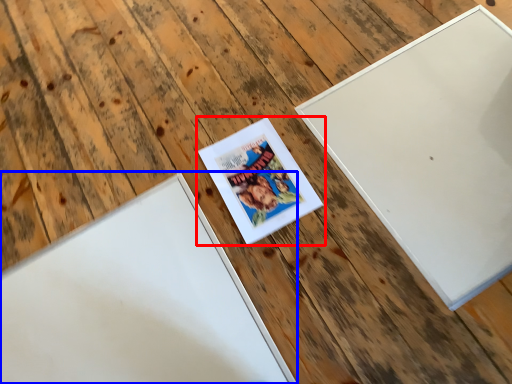
Question: Which of the following is the farthest to the observer, picture frame (highlighted by a red box) or picture frame (highlighted by a blue box)?

Choices:
 (A) picture frame
 (B) picture frame

Answer: (A)